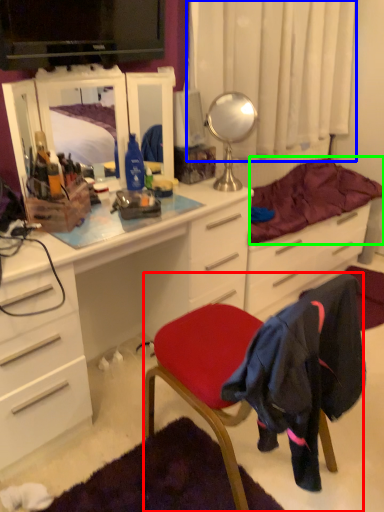
Question: Which object is positioned farthest from chair (highlighted by a red box)? Select from curtain (highlighted by a blue box) and bedding (highlighted by a green box).

Choices:
 (A) curtain
 (B) bedding

Answer: (A)